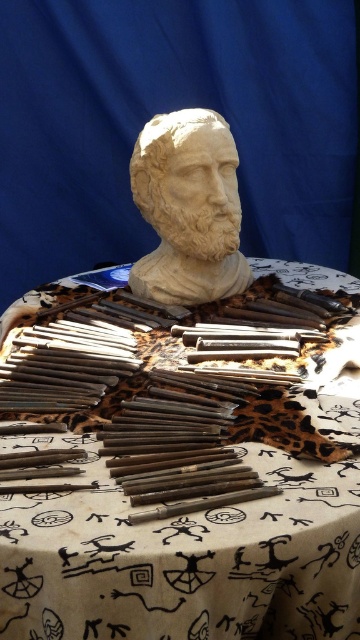
Question: Is brown wood table at center to the left of matte stone bust at center from the viewer's perspective?

Choices:
 (A) no
 (B) yes

Answer: (A)

Question: Is brown wood table at center bigger than matte stone bust at center?

Choices:
 (A) yes
 (B) no

Answer: (A)

Question: Does brown wood table at center appear on the left side of matte stone bust at center?

Choices:
 (A) no
 (B) yes

Answer: (A)

Question: Which object appears farthest from the camera in this image?

Choices:
 (A) brown wood table at center
 (B) matte stone bust at center

Answer: (B)

Question: Which point is farther to the camera?

Choices:
 (A) (165, 218)
 (B) (275, 266)

Answer: (B)